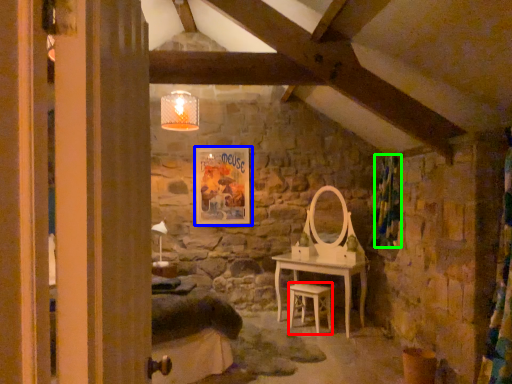
Question: Which is farther away from chair (highlighted by a red box)? picture frame (highlighted by a blue box) or curtain (highlighted by a green box)?

Choices:
 (A) picture frame
 (B) curtain

Answer: (A)